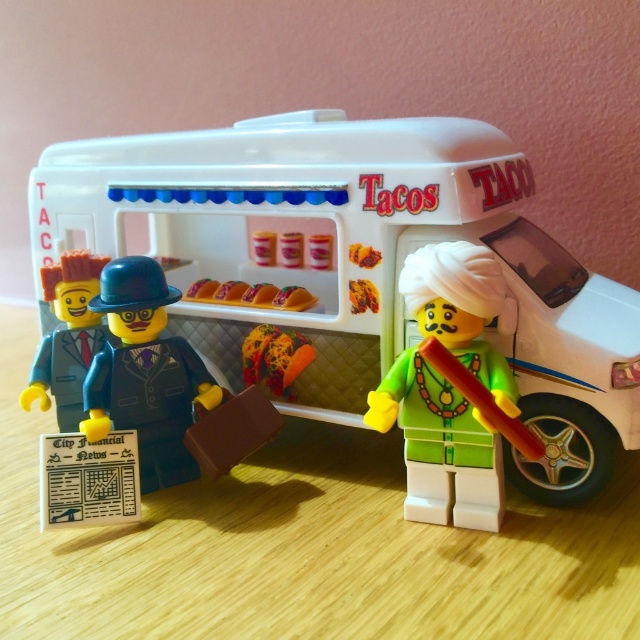
Where is the smooth plastic man at left located in the image?

The smooth plastic man at left is located at point 0.527 on the x axis and 0.106 on the y axis.

You are a toy organizer trying to categorize items on a shelf. You see the green matte turban at center and the smooth plastic tacos at center. Which item should be placed lower on the shelf to maintain their current spatial relationship?

The green matte turban at center should be placed lower on the shelf because it is located below the smooth plastic tacos at center in the current arrangement.